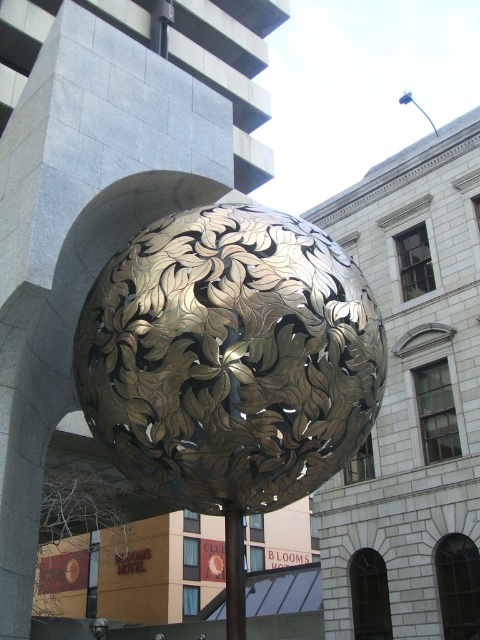
Is gold metallic sphere at center closer to camera compared to gold metallic pole at center?

Yes, it is in front of gold metallic pole at center.

This screenshot has width=480, height=640. Describe the element at coordinates (229, 358) in the screenshot. I see `gold metallic sphere at center` at that location.

Which is behind, point (122, 429) or point (237, 531)?

Point (237, 531)

Where is `gold metallic sphere at center`? Image resolution: width=480 pixels, height=640 pixels. gold metallic sphere at center is located at coordinates (229, 358).